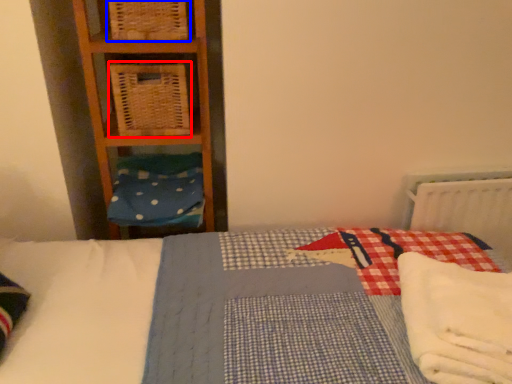
Question: Which object appears closest to the camera in this image, crate (highlighted by a red box) or crate (highlighted by a blue box)?

Choices:
 (A) crate
 (B) crate

Answer: (B)